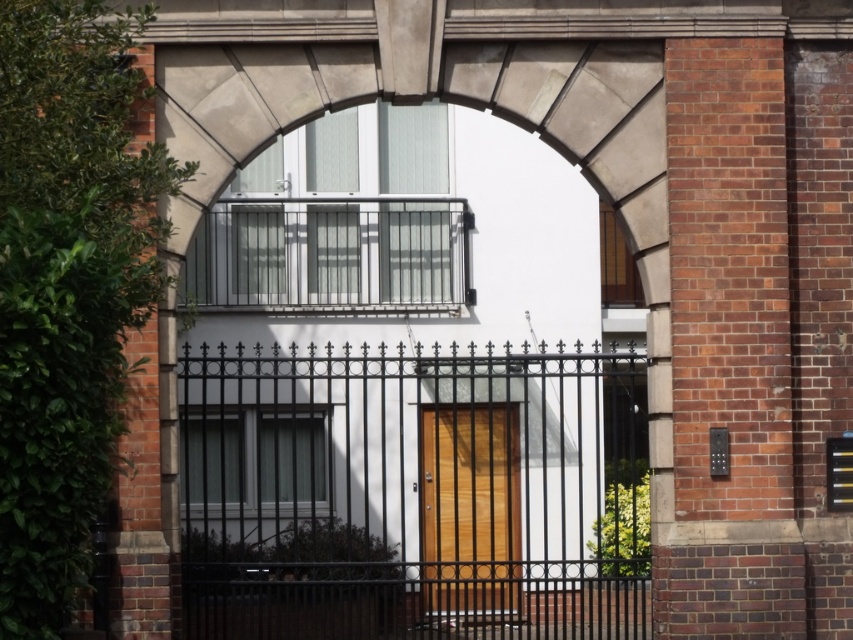
You are a delivery person trying to reach the wooden door at center. There is a black wrought iron gate at center in your way. Which direction should you move to go around it and reach the door?

The black wrought iron gate at center is on the left side of the wooden door at center, so you should move to the right to go around the gate and reach the door.

You are a delivery person standing at the base of the building. You need to deliver a package to the apartment above the wooden door at center. The balcony is in your way. Can you walk under the metallic silver balcony at upper center to reach the door without going around?

The metallic silver balcony at upper center is closer to the viewer than the wooden door at center, so you can walk under the metallic silver balcony at upper center to reach the wooden door at center since it is positioned in front of the door.